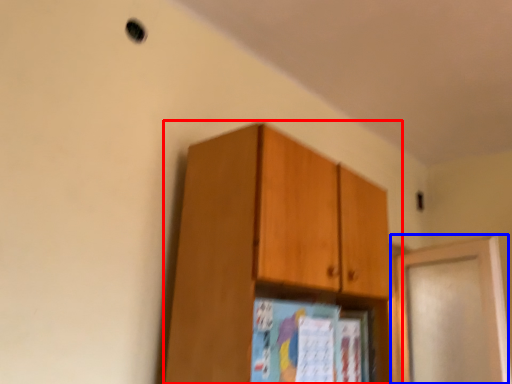
Question: Which object appears closest to the camera in this image, cabinetry (highlighted by a red box) or door (highlighted by a blue box)?

Choices:
 (A) cabinetry
 (B) door

Answer: (A)